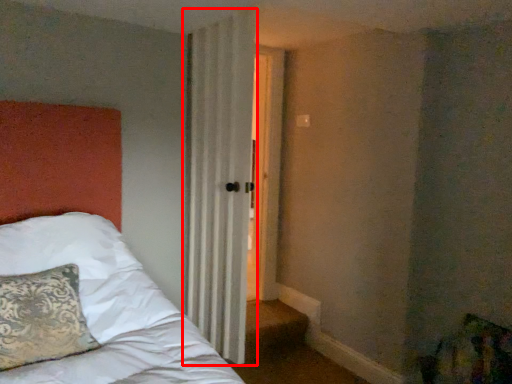
Question: From the image's perspective, where is curtain (annotated by the red box) located in relation to pillow in the image?

Choices:
 (A) above
 (B) below

Answer: (A)